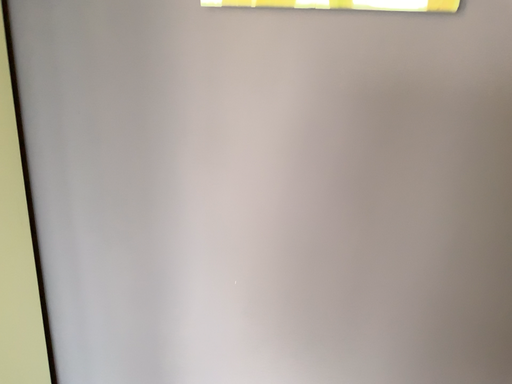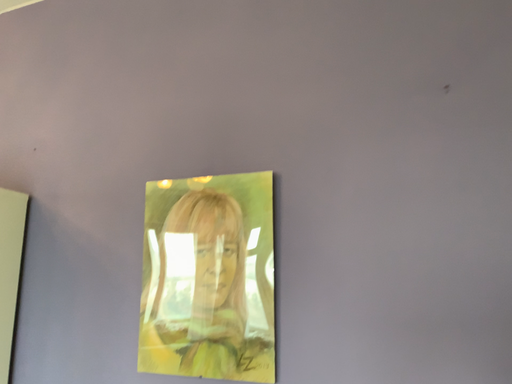
Question: Which way did the camera rotate in the video?

Choices:
 (A) rotated upward
 (B) rotated downward

Answer: (A)